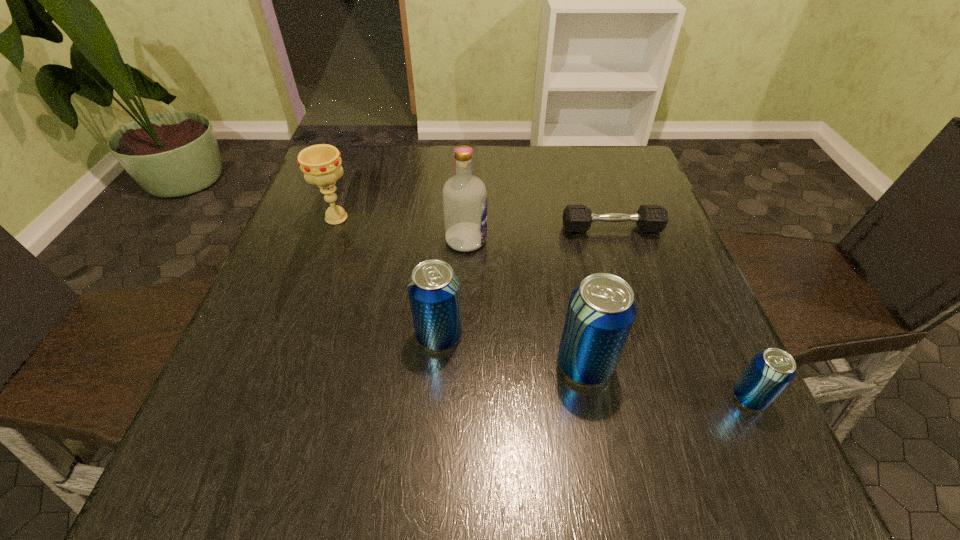
Where is `vacant space located on the front of the leftmost object`? This screenshot has width=960, height=540. vacant space located on the front of the leftmost object is located at coordinates (319, 266).

Identify the location of vacant space located on the label of the vodka. (561, 240).

The image size is (960, 540). Find the location of `vacant area situated on the left of the dumbbell`. vacant area situated on the left of the dumbbell is located at coordinates (452, 229).

Identify the location of object that is at the left edge. The image size is (960, 540). (321, 164).

The image size is (960, 540). I want to click on beer can situated at the right edge, so click(770, 371).

Where is `dumbbell situated at the right edge`? Image resolution: width=960 pixels, height=540 pixels. dumbbell situated at the right edge is located at coordinates (576, 218).

Image resolution: width=960 pixels, height=540 pixels. I want to click on object at the near right corner, so click(x=770, y=371).

Where is `blank space at the far edge of the desktop`? The height and width of the screenshot is (540, 960). blank space at the far edge of the desktop is located at coordinates (386, 148).

Identify the location of free space at the near edge. The width and height of the screenshot is (960, 540). (528, 407).

The height and width of the screenshot is (540, 960). Find the location of `vacant space at the left edge of the desktop`. vacant space at the left edge of the desktop is located at coordinates (324, 226).